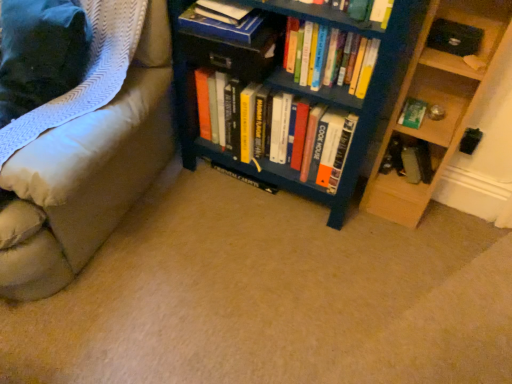
The width and height of the screenshot is (512, 384). I want to click on free space that is in between wooden at right and blue painted wood bookcase at center, so click(x=381, y=225).